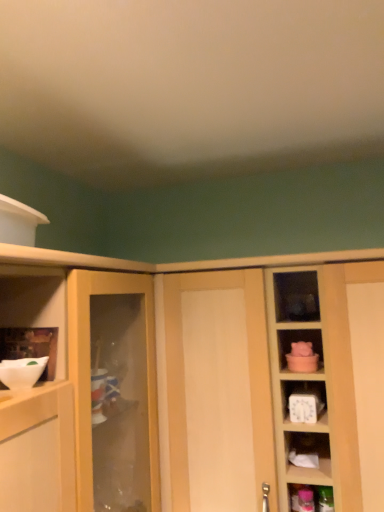
Question: Considering the relative sizes of white glossy bowl at left and white matte mixing bowl at left in the image provided, is white glossy bowl at left bigger than white matte mixing bowl at left?

Choices:
 (A) yes
 (B) no

Answer: (B)

Question: Does white glossy bowl at left have a greater width compared to white matte mixing bowl at left?

Choices:
 (A) yes
 (B) no

Answer: (B)

Question: Considering the relative sizes of white glossy bowl at left and white matte mixing bowl at left in the image provided, is white glossy bowl at left thinner than white matte mixing bowl at left?

Choices:
 (A) yes
 (B) no

Answer: (A)

Question: Is white glossy bowl at left smaller than white matte mixing bowl at left?

Choices:
 (A) no
 (B) yes

Answer: (B)

Question: Is white glossy bowl at left to the left of white matte mixing bowl at left from the viewer's perspective?

Choices:
 (A) yes
 (B) no

Answer: (A)

Question: Is white glossy bowl at left not within white matte mixing bowl at left?

Choices:
 (A) no
 (B) yes

Answer: (B)

Question: Is white matte mixing bowl at left to the right of light wood cabinet at center from the viewer's perspective?

Choices:
 (A) yes
 (B) no

Answer: (B)

Question: Does white matte mixing bowl at left have a greater height compared to light wood cabinet at center?

Choices:
 (A) yes
 (B) no

Answer: (B)

Question: Is white matte mixing bowl at left positioned in front of light wood cabinet at center?

Choices:
 (A) yes
 (B) no

Answer: (A)

Question: Is white matte mixing bowl at left facing towards light wood cabinet at center?

Choices:
 (A) yes
 (B) no

Answer: (B)

Question: Considering the relative sizes of white matte mixing bowl at left and light wood cabinet at center in the image provided, is white matte mixing bowl at left smaller than light wood cabinet at center?

Choices:
 (A) yes
 (B) no

Answer: (A)

Question: Is white matte mixing bowl at left placed right next to light wood cabinet at center?

Choices:
 (A) no
 (B) yes

Answer: (A)

Question: From a real-world perspective, is white matte mixing bowl at left on top of white glossy bowl at left?

Choices:
 (A) no
 (B) yes

Answer: (A)